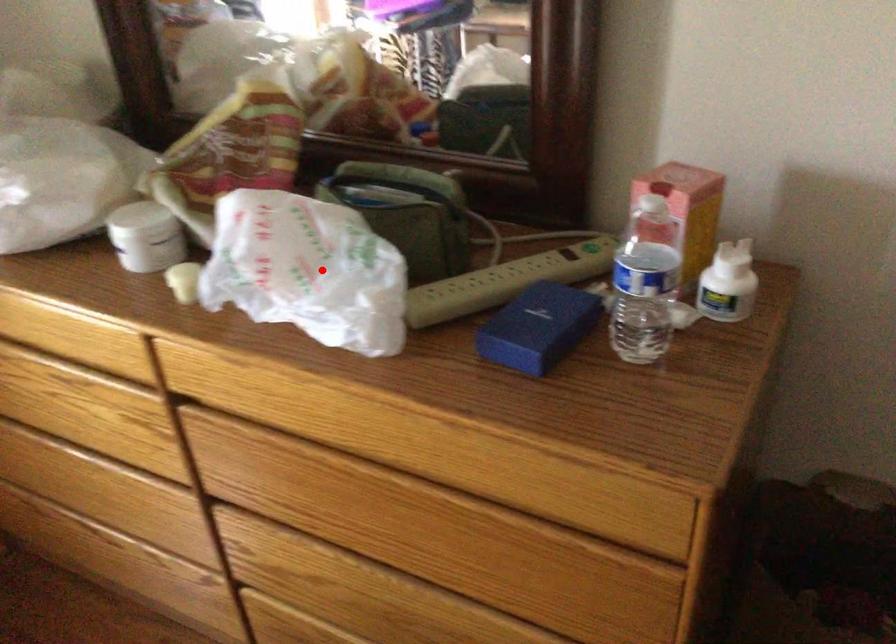
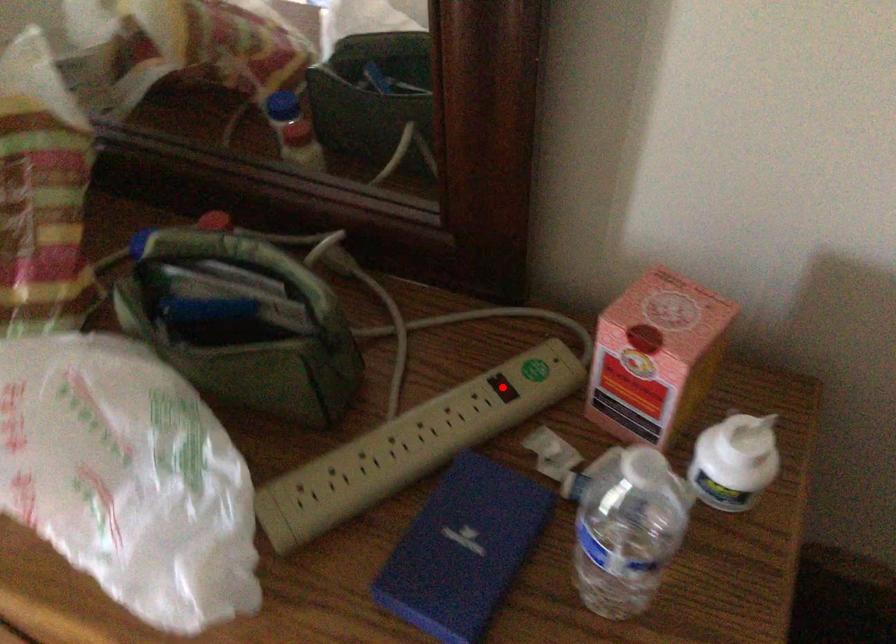
I am providing you with two images of the same scene from different viewpoints. A red point is marked on the first image and another point is marked on the second image. Is the red point in image1 aligned with the point shown in image2?

No